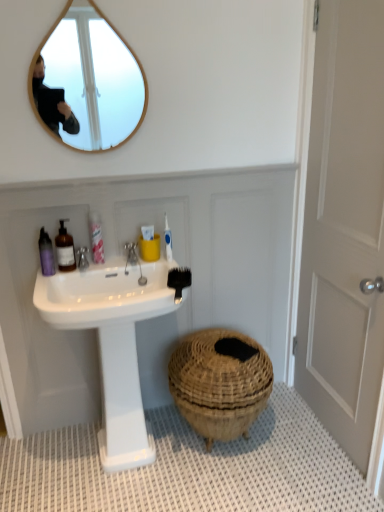
The width and height of the screenshot is (384, 512). What do you see at coordinates (344, 227) in the screenshot? I see `white matte door at right` at bounding box center [344, 227].

What do you see at coordinates (96, 238) in the screenshot? I see `pink plastic bottle at upper left, the 3th toiletry in the left-to-right sequence` at bounding box center [96, 238].

Looking at this image, measure the distance between brown woven basket at lower center and camera.

1.70 meters.

In order to face black plastic comb at upper center, should I rotate leftwards or rightwards?

Turn left approximately 1.896 degrees to face it.

In order to face teak wood mirror at upper left, should I rotate leftwards or rightwards?

Rotate your view left by about 13.279°.

What do you see at coordinates (113, 342) in the screenshot?
I see `white glossy sink at center` at bounding box center [113, 342].

Identify the location of white matte door at right. This screenshot has height=512, width=384. (344, 227).

Does silver metallic faucet at sink left have a greater width compared to white glossy toothpaste at upper center?

Indeed, silver metallic faucet at sink left has a greater width compared to white glossy toothpaste at upper center.

Is silver metallic faucet at sink left facing towards white glossy toothpaste at upper center?

No, silver metallic faucet at sink left does not turn towards white glossy toothpaste at upper center.

From the image's perspective, relative to white glossy toothpaste at upper center, is silver metallic faucet at sink left above or below?

From the image's perspective, silver metallic faucet at sink left appears below white glossy toothpaste at upper center.

Would you say silver metallic faucet at sink left contains white glossy toothpaste at upper center?

Definitely not — white glossy toothpaste at upper center is not inside silver metallic faucet at sink left.

Is point (169, 260) more distant than point (86, 251)?

Yes.

From the picture: From a real-world perspective, is white glossy toothpaste at upper center on top of silver metallic faucet at sink left?

Yes.

Looking at this image, does white glossy toothpaste at upper center come behind silver metallic faucet at sink left?

Yes, it is behind silver metallic faucet at sink left.

From the image's perspective, does white glossy toothpaste at upper center appear higher than silver metallic faucet at sink left?

Indeed, from the image's perspective, white glossy toothpaste at upper center is shown above silver metallic faucet at sink left.

Is matte purple bottle at upper left, which is the 1th toiletry from left to right, not close to white matte door at right?

Indeed, matte purple bottle at upper left, which is the 1th toiletry from left to right, is not near white matte door at right.

From a real-world perspective, starting from the white matte door at right, which toiletry is the 2nd one vertically above it? Please provide its 2D coordinates.

[(46, 254)]

Is matte purple bottle at upper left, which is the 3th toiletry from right to left, taller than white matte door at right?

Incorrect, the height of matte purple bottle at upper left, which is the 3th toiletry from right to left, is not larger of that of white matte door at right.

How different are the orientations of white matte door at right and pink plastic bottle at upper left, the 3th toiletry in the left-to-right sequence, in degrees?

The facing directions of white matte door at right and pink plastic bottle at upper left, the 3th toiletry in the left-to-right sequence, are 91.7 degrees apart.

Considering the positions of objects white matte door at right and pink plastic bottle at upper left, the first toiletry viewed from the right, in the image provided, who is more to the left, white matte door at right or pink plastic bottle at upper left, the first toiletry viewed from the right,?

Positioned to the left is pink plastic bottle at upper left, the first toiletry viewed from the right.

From the image's perspective, which one is positioned lower, white matte door at right or pink plastic bottle at upper left, the 3th toiletry in the left-to-right sequence?

white matte door at right.

Is white matte door at right aimed at pink plastic bottle at upper left, the 3th toiletry in the left-to-right sequence?

Yes.

From the image's perspective, is white glossy toothpaste at upper center above white textured bath mat at lower center?

Yes, from the image's perspective, white glossy toothpaste at upper center is on top of white textured bath mat at lower center.

In the image, is white glossy toothpaste at upper center positioned in front of or behind white textured bath mat at lower center?

white glossy toothpaste at upper center is positioned farther from the viewer than white textured bath mat at lower center.

From a real-world perspective, is white glossy toothpaste at upper center physically located above or below white textured bath mat at lower center?

In terms of real-world spatial position, white glossy toothpaste at upper center is above white textured bath mat at lower center.

Is white glossy toothpaste at upper center bigger than white textured bath mat at lower center?

No.

Is teak wood mirror at upper left taller or shorter than white textured bath mat at lower center?

In the image, teak wood mirror at upper left appears to be taller than white textured bath mat at lower center.

The width and height of the screenshot is (384, 512). I want to click on mirror behind the white textured bath mat at lower center, so click(x=88, y=81).

From the image's perspective, is teak wood mirror at upper left on white textured bath mat at lower center?

Correct, teak wood mirror at upper left appears higher than white textured bath mat at lower center in the image.

Could you tell me if teak wood mirror at upper left is facing white textured bath mat at lower center?

No, teak wood mirror at upper left is not facing towards white textured bath mat at lower center.

Which object is closer to the camera taking this photo, black plastic comb at upper center or brown woven basket at lower center?

black plastic comb at upper center is closer to the camera.

Is brown woven basket at lower center at the back of black plastic comb at upper center?

That's not correct — black plastic comb at upper center is not looking away from brown woven basket at lower center.

From the picture: Between black plastic comb at upper center and brown woven basket at lower center, which one has larger size?

brown woven basket at lower center.

Would you say brown woven basket at lower center is part of black plastic comb at upper center's contents?

No, black plastic comb at upper center does not contain brown woven basket at lower center.

Where is `tap below the white glossy toothpaste at upper center (from the image's perspective)`? This screenshot has width=384, height=512. tap below the white glossy toothpaste at upper center (from the image's perspective) is located at coordinates (82, 258).

This screenshot has width=384, height=512. What are the coordinates of `tap that is under the white glossy toothpaste at upper center (from a real-world perspective)` in the screenshot? It's located at (82, 258).

Looking at the image, which one is located further to white textured bath mat at lower center, white glossy toothpaste at upper center or silver metallic faucet at sink left?

silver metallic faucet at sink left is positioned further to the anchor white textured bath mat at lower center.

Which object lies nearer to the anchor point translucent glass soap dispenser at left, which ranks as the second toiletry in left-to-right order, white matte door at right or white glossy toothpaste at upper center?

white glossy toothpaste at upper center lies closer to translucent glass soap dispenser at left, which ranks as the second toiletry in left-to-right order, than the other object.

Based on their spatial positions, is white matte door at right or matte purple bottle at upper left, which is the 1th toiletry from left to right, further from silver metallic faucet at upper center?

The object further to silver metallic faucet at upper center is white matte door at right.

Estimate the real-world distances between objects in this image. Which object is further from silver metallic faucet at upper center, silver metallic faucet at sink left or teak wood mirror at upper left?

teak wood mirror at upper left is positioned further to the anchor silver metallic faucet at upper center.

Which object lies nearer to the anchor point brown woven basket at lower center, white glossy toothpaste at upper center or white textured bath mat at lower center?

white textured bath mat at lower center.

Based on their spatial positions, is white glossy sink at center or black plastic comb at upper center further from pink plastic bottle at upper left, the 3th toiletry in the left-to-right sequence?

black plastic comb at upper center.

Based on their spatial positions, is silver metallic faucet at upper center or white matte door at right further from white glossy toothpaste at upper center?

The object further to white glossy toothpaste at upper center is white matte door at right.

Estimate the real-world distances between objects in this image. Which object is closer to white textured bath mat at lower center, translucent glass soap dispenser at left, which ranks as the second toiletry in left-to-right order, or silver metallic faucet at sink left?

translucent glass soap dispenser at left, which ranks as the second toiletry in left-to-right order, is positioned closer to the anchor white textured bath mat at lower center.

The image size is (384, 512). What are the coordinates of `faucet between silver metallic faucet at sink left and white glossy toothpaste at upper center` in the screenshot? It's located at (131, 255).

The image size is (384, 512). Find the location of `faucet between matte purple bottle at upper left, which is the 1th toiletry from left to right, and white glossy toothpaste at upper center, in the horizontal direction`. faucet between matte purple bottle at upper left, which is the 1th toiletry from left to right, and white glossy toothpaste at upper center, in the horizontal direction is located at coordinates pyautogui.click(x=131, y=255).

Identify the location of toiletry between silver metallic faucet at sink left and white matte door at right in the horizontal direction. Image resolution: width=384 pixels, height=512 pixels. (96, 238).

Where is `tap between matte purple bottle at upper left, which is the 3th toiletry from right to left, and white matte door at right`? tap between matte purple bottle at upper left, which is the 3th toiletry from right to left, and white matte door at right is located at coordinates (82, 258).